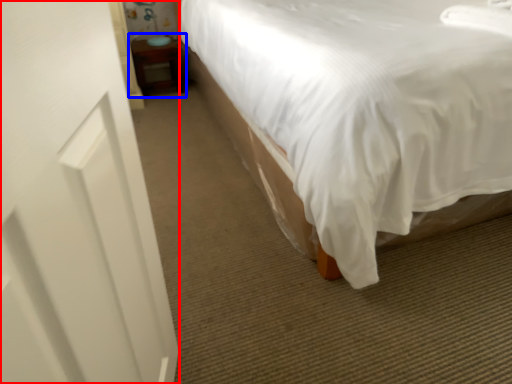
Question: Among these objects, which one is nearest to the camera, screen door (highlighted by a red box) or table (highlighted by a blue box)?

Choices:
 (A) screen door
 (B) table

Answer: (A)